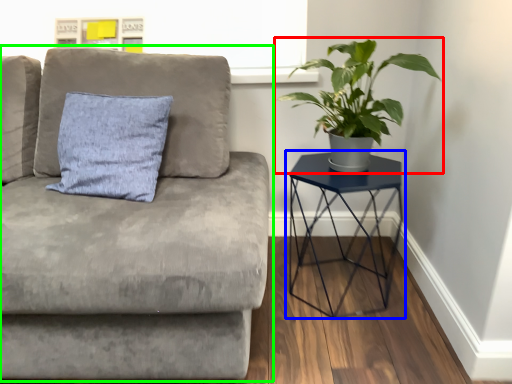
Question: Which object is the closest to the houseplant (highlighted by a red box)? Choose among these: table (highlighted by a blue box) or studio couch (highlighted by a green box).

Choices:
 (A) table
 (B) studio couch

Answer: (A)